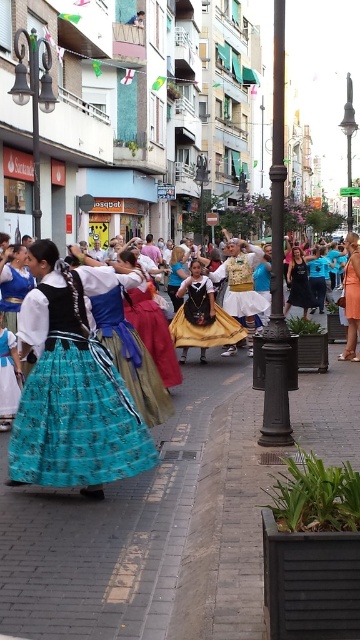
Question: Is matte black dress at center positioned behind white cotton dress at center?

Choices:
 (A) no
 (B) yes

Answer: (B)

Question: Is golden yellow fabric dress at center further to camera compared to orange fabric dress at center?

Choices:
 (A) no
 (B) yes

Answer: (B)

Question: Among these objects, which one is nearest to the camera?

Choices:
 (A) golden yellow fabric dress at center
 (B) orange fabric dress at center
 (C) turquoise fabric skirt at lower left

Answer: (C)

Question: Which object is the closest to the orange fabric dress at center?

Choices:
 (A) turquoise fabric skirt at lower left
 (B) blue satin skirt at center

Answer: (B)

Question: From the image, what is the correct spatial relationship of polished metal pole at center in relation to matte black dress at center?

Choices:
 (A) above
 (B) below

Answer: (A)

Question: Which of these objects is positioned farthest from the polished metal pole at center?

Choices:
 (A) golden yellow fabric dress at center
 (B) blue satin dress at lower left
 (C) turquoise fabric skirt at lower left

Answer: (B)